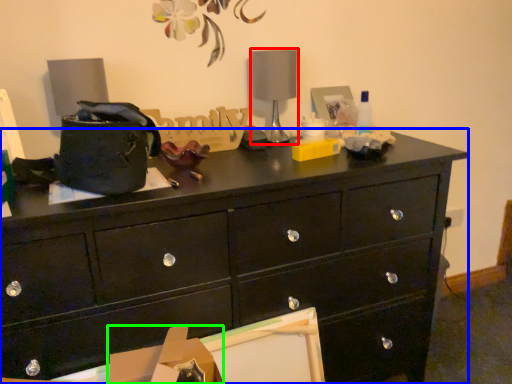
Question: Considering the real-world distances, which object is closest to table lamp (highlighted by a red box)? chest of drawers (highlighted by a blue box) or cardboard box (highlighted by a green box).

Choices:
 (A) chest of drawers
 (B) cardboard box

Answer: (A)